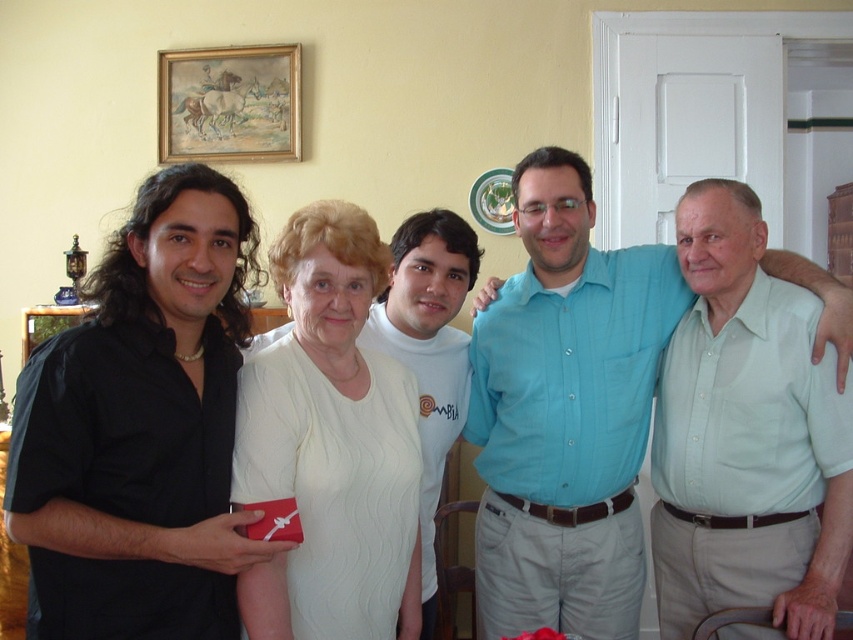
You are standing in the living room and want to move from the point at coordinates (x=202, y=99) to the point at coordinates (x=39, y=337). Which direction should you move to get closer to your destination?

You should move downward because point (x=39, y=337) is located lower on the Y axis than point (x=202, y=99).

You are organizing a clothing donation drive and need to sort items by color. You have two shirts, the light blue shirt at center and the light green shirt at center. Which shirt should you place to the left of the other to maintain the correct color sequence from left to right as blue then green?

The light blue shirt at center should be placed to the left of the light green shirt at center to maintain the correct color sequence from left to right as blue then green.